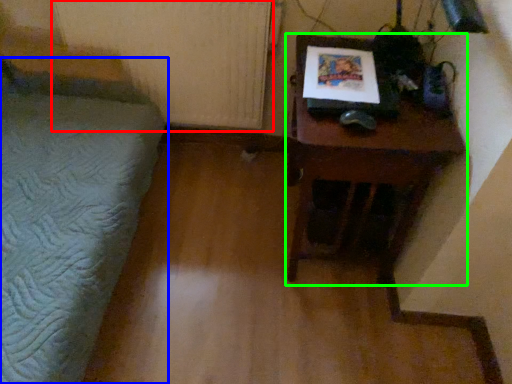
Question: Which is nearer to the radiator (highlighted by a red box)? furniture (highlighted by a blue box) or table (highlighted by a green box).

Choices:
 (A) furniture
 (B) table

Answer: (A)